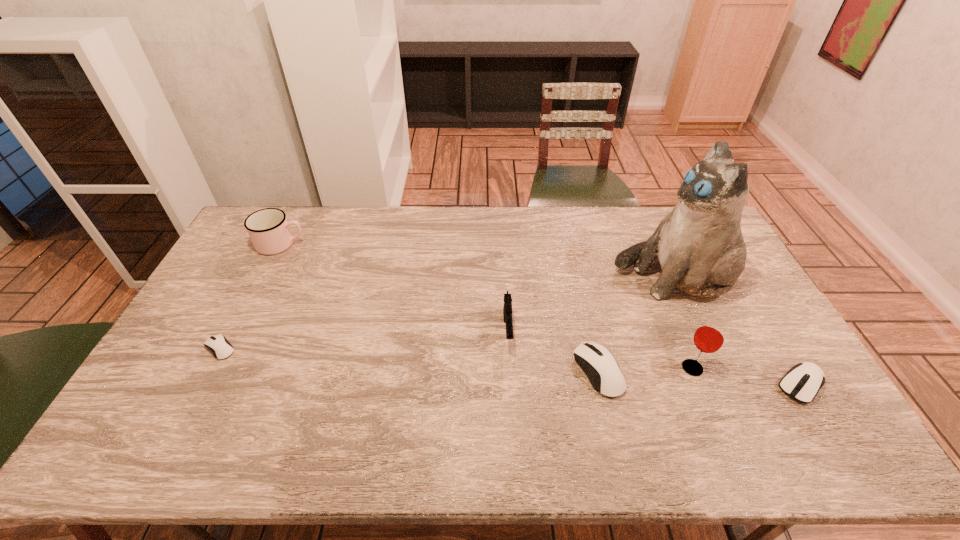
This screenshot has width=960, height=540. I want to click on vacant region located 0.320m on the right of the fourth object from left to right, so click(738, 372).

Where is `free space located 0.150m on the back of the rightmost mouse`? free space located 0.150m on the back of the rightmost mouse is located at coordinates (764, 323).

The width and height of the screenshot is (960, 540). Find the location of `blank space located 0.190m on the side of the mug with the handle`. blank space located 0.190m on the side of the mug with the handle is located at coordinates (358, 244).

Locate an element on the screen. free space located 0.110m at the face of the cat is located at coordinates (580, 275).

The height and width of the screenshot is (540, 960). I want to click on free spot located at the face of the cat, so click(568, 275).

The height and width of the screenshot is (540, 960). I want to click on free location located 0.200m at the face of the cat, so click(553, 275).

The width and height of the screenshot is (960, 540). I want to click on vacant space located 0.380m on the back of the sixth shortest object, so click(x=651, y=267).

The width and height of the screenshot is (960, 540). Find the location of `vacant space situated on the front-facing side of the fifth object from right to left`. vacant space situated on the front-facing side of the fifth object from right to left is located at coordinates (510, 374).

Locate an element on the screen. object that is at the far edge is located at coordinates (268, 228).

At what (x,y) coordinates should I click in order to perform the action: click on mouse positioned at the left edge. Please return your answer as a coordinate pair (x, y). This screenshot has width=960, height=540. Looking at the image, I should click on (220, 347).